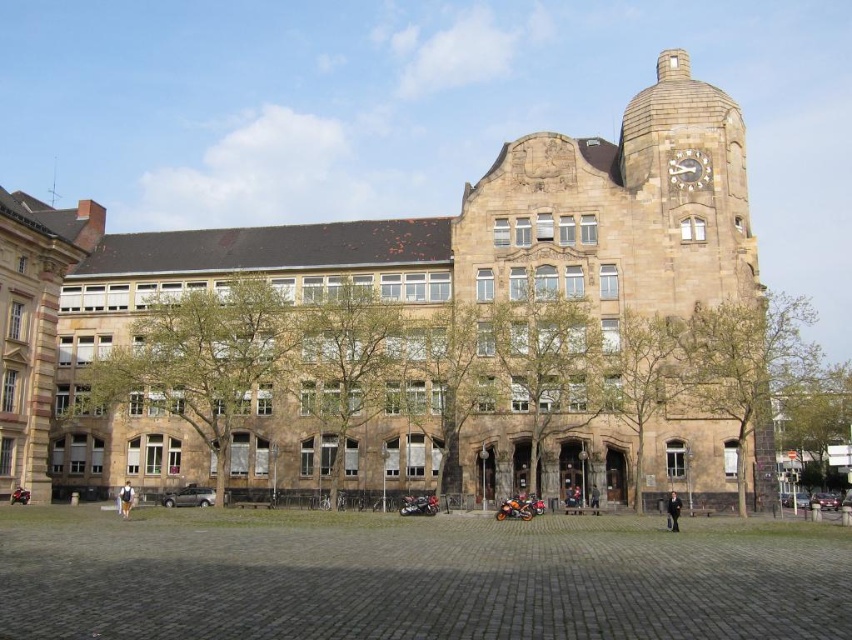
Who is lower down, brown stone clock tower at upper right or silver metallic clock at upper center?

silver metallic clock at upper center is lower down.

Which of these two, brown stone clock tower at upper right or silver metallic clock at upper center, stands shorter?

Standing shorter between the two is silver metallic clock at upper center.

This screenshot has width=852, height=640. I want to click on brown stone clock tower at upper right, so click(x=688, y=193).

Who is more forward, (666, 506) or (127, 508)?

Point (127, 508) is in front.

Which is more to the left, dark brown leather jacket at lower right or brown leather jacket at lower left?

brown leather jacket at lower left

Is point (671, 492) in front of point (128, 499)?

No, (671, 492) is further to viewer.

At what (x,y) coordinates should I click in order to perform the action: click on dark brown leather jacket at lower right. Please return your answer as a coordinate pair (x, y). The image size is (852, 640). Looking at the image, I should click on (672, 512).

Is silver metallic clock at upper center to the left of dark brown leather jacket at lower right from the viewer's perspective?

In fact, silver metallic clock at upper center is to the right of dark brown leather jacket at lower right.

Does silver metallic clock at upper center have a larger size compared to dark brown leather jacket at lower right?

Actually, silver metallic clock at upper center might be smaller than dark brown leather jacket at lower right.

Does point (709, 173) come in front of point (678, 509)?

No, it is not.

Where is `silver metallic clock at upper center`? The image size is (852, 640). silver metallic clock at upper center is located at coordinates (689, 168).